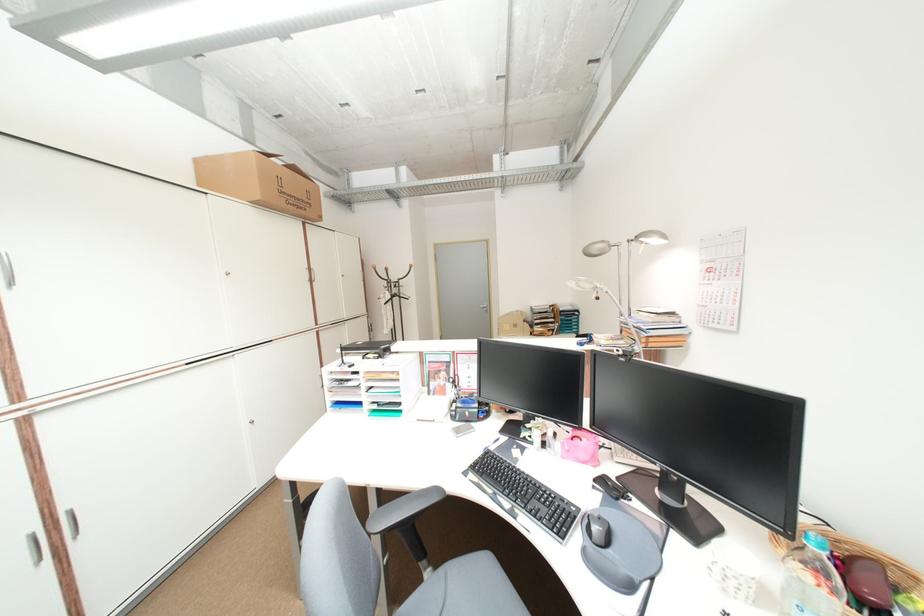
Where would you sit the grey chair sitting surface? Please return your answer as a coordinate pair (x, y).

(473, 576)